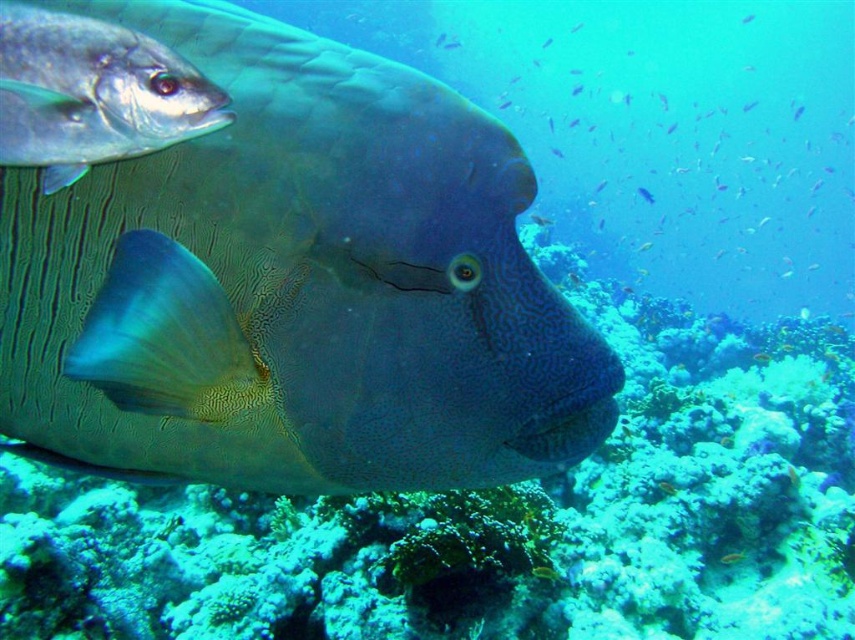
Question: Is shiny silver fish at upper left smaller than shiny yellow fish at center?

Choices:
 (A) no
 (B) yes

Answer: (A)

Question: Does textured gray fish at center appear over shiny yellow fish at center?

Choices:
 (A) no
 (B) yes

Answer: (B)

Question: Which of the following is the farthest from the observer?

Choices:
 (A) textured coral reef at center
 (B) shiny yellow fish at center
 (C) textured gray fish at center
 (D) satin blue fish at center

Answer: (D)

Question: Considering the relative positions of textured gray fish at center and shiny silver fish at upper left in the image provided, where is textured gray fish at center located with respect to shiny silver fish at upper left?

Choices:
 (A) left
 (B) right

Answer: (B)

Question: Which object is the farthest from the textured coral reef at center?

Choices:
 (A) shiny yellow fish at center
 (B) satin blue fish at center
 (C) shiny silver fish at upper left
 (D) textured gray fish at center

Answer: (B)

Question: Which of the following is the closest to the observer?

Choices:
 (A) (617, 614)
 (B) (740, 556)
 (C) (649, 202)
 (D) (435, 170)

Answer: (D)